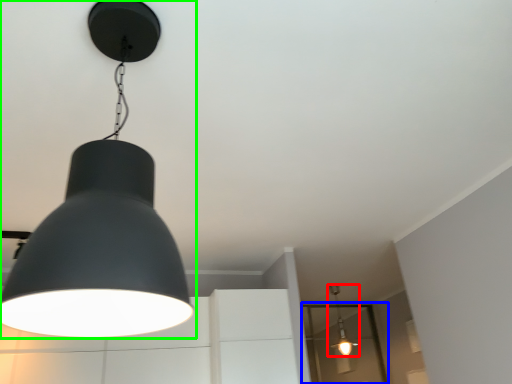
Question: Which is farther away from lamp (highlighted by a red box)? glass door (highlighted by a blue box) or lamp (highlighted by a green box)?

Choices:
 (A) glass door
 (B) lamp

Answer: (B)